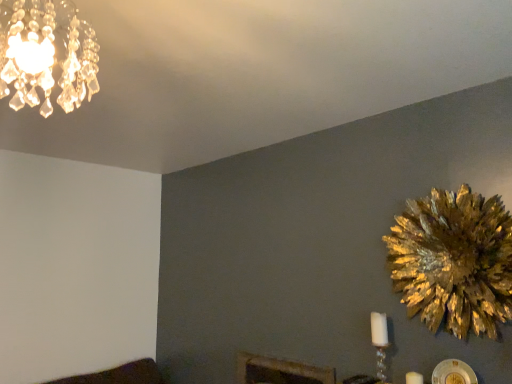
Question: From the image's perspective, is crystal glass chandelier at upper left above or below white glass candle at lower right?

Choices:
 (A) below
 (B) above

Answer: (B)

Question: Considering the positions of point (84, 24) and point (377, 336), is point (84, 24) closer or farther from the camera than point (377, 336)?

Choices:
 (A) closer
 (B) farther

Answer: (A)

Question: Which object is the farthest from the white matte candle at lower right?

Choices:
 (A) crystal glass chandelier at upper left
 (B) gold metallic flower at right
 (C) white glass candle at lower right

Answer: (A)

Question: Based on their relative distances, which object is nearer to the gold metallic flower at right?

Choices:
 (A) white glass candle at lower right
 (B) white matte candle at lower right
 (C) crystal glass chandelier at upper left

Answer: (A)